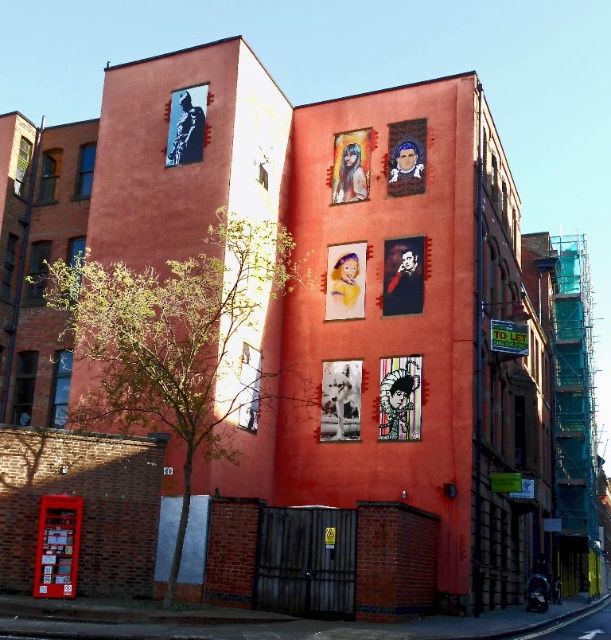
From the picture: You are a delivery person standing in front of the red building and need to place a 4 meter long ladder between the pastel yellow paper at center and the matte paper poster at upper center. Will the ladder fit between them?

The distance between the pastel yellow paper at center and the matte paper poster at upper center is 4.15 meters, so the 4 meter long ladder will fit between them since it is shorter than the available space.

You are an artist standing in front of the red building. You see a pastel yellow paper at center and a matte paper poster at upper center. Which object is closer to the ground?

The pastel yellow paper at center is closer to the ground because it is located below the matte paper poster at upper center.